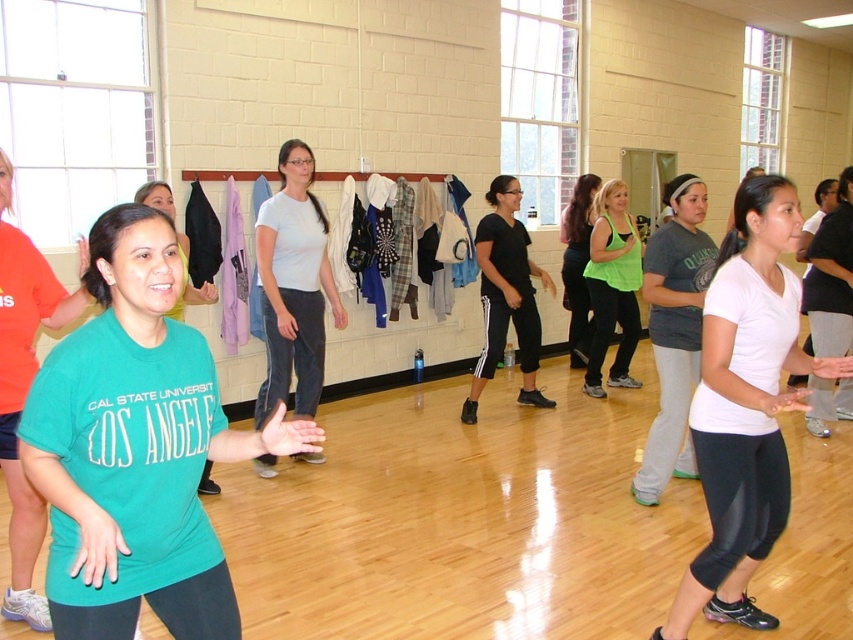
Does green matte tank top at center have a larger size compared to green fabric tank top at center?

Correct, green matte tank top at center is larger in size than green fabric tank top at center.

Which is in front, point (625, 269) or point (578, 310)?

Point (625, 269) is more forward.

Is point (630, 248) closer to camera compared to point (595, 179)?

Yes, it is in front of point (595, 179).

Locate an element on the screen. This screenshot has height=640, width=853. green matte tank top at center is located at coordinates (612, 288).

Does point (305, 163) lie in front of point (689, 275)?

That is False.

Locate an element on the screen. The image size is (853, 640). white cotton shirt at center is located at coordinates (293, 285).

Where is `white cotton shirt at center`? This screenshot has height=640, width=853. white cotton shirt at center is located at coordinates (293, 285).

Is white cotton shirt at center below green fabric tank top at center?

Correct, white cotton shirt at center is located below green fabric tank top at center.

Who is positioned more to the right, white cotton shirt at center or green fabric tank top at center?

green fabric tank top at center

Does point (320, 388) lie in front of point (579, 321)?

Yes, point (320, 388) is closer to viewer.

This screenshot has width=853, height=640. I want to click on white cotton shirt at center, so click(x=293, y=285).